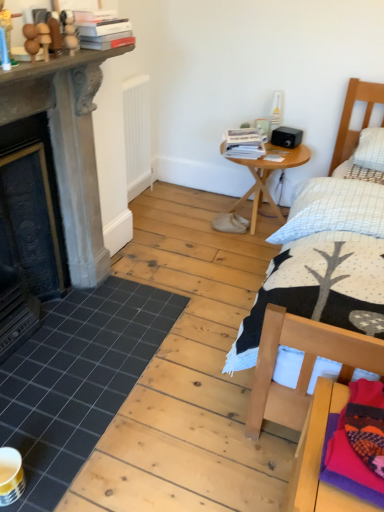
Question: Can you confirm if black tile at lower left is bigger than wooden bed at right?

Choices:
 (A) no
 (B) yes

Answer: (A)

Question: Is black tile at lower left in front of wooden bed at right?

Choices:
 (A) no
 (B) yes

Answer: (A)

Question: Is black tile at lower left facing towards wooden bed at right?

Choices:
 (A) no
 (B) yes

Answer: (B)

Question: Can you confirm if black tile at lower left is wider than wooden bed at right?

Choices:
 (A) no
 (B) yes

Answer: (A)

Question: Is there a large distance between black tile at lower left and wooden bed at right?

Choices:
 (A) no
 (B) yes

Answer: (A)

Question: Is hardcover book at upper left, the 1th book when ordered from left to right, situated inside black tile at lower left or outside?

Choices:
 (A) outside
 (B) inside

Answer: (A)

Question: Relative to black tile at lower left, is hardcover book at upper left, the 3th book from the back, in front or behind?

Choices:
 (A) front
 (B) behind

Answer: (B)

Question: Considering the relative positions of hardcover book at upper left, which ranks as the third book in right-to-left order, and black tile at lower left in the image provided, is hardcover book at upper left, which ranks as the third book in right-to-left order, to the left or to the right of black tile at lower left?

Choices:
 (A) right
 (B) left

Answer: (A)

Question: From a real-world perspective, is hardcover book at upper left, arranged as the first book when viewed from the front, positioned above or below black tile at lower left?

Choices:
 (A) below
 (B) above

Answer: (B)

Question: In terms of width, does white paper stack at upper right, placed as the third book when sorted from left to right, look wider or thinner when compared to black tile at lower left?

Choices:
 (A) thin
 (B) wide

Answer: (A)

Question: Relative to black tile at lower left, is white paper stack at upper right, placed as the third book when sorted from left to right, in front or behind?

Choices:
 (A) behind
 (B) front

Answer: (A)

Question: Would you say white paper stack at upper right, positioned as the 3th book in front-to-back order, is to the left or to the right of black tile at lower left in the picture?

Choices:
 (A) left
 (B) right

Answer: (B)

Question: Is point (238, 140) positioned closer to the camera than point (97, 343)?

Choices:
 (A) farther
 (B) closer

Answer: (A)

Question: From the image's perspective, is hardcover book at upper left, arranged as the first book when viewed from the front, above or below knitted woolen blanket at lower right?

Choices:
 (A) above
 (B) below

Answer: (A)

Question: In terms of width, does hardcover book at upper left, arranged as the first book when viewed from the front, look wider or thinner when compared to knitted woolen blanket at lower right?

Choices:
 (A) wide
 (B) thin

Answer: (B)